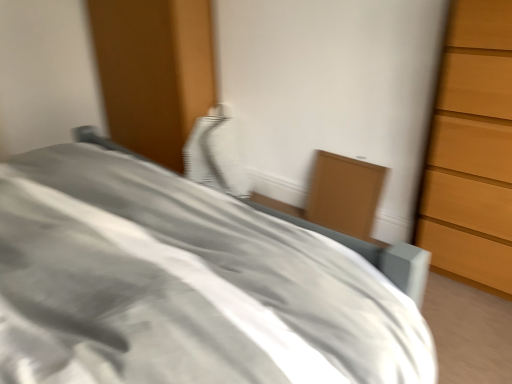
Question: Would you say matte wood cabinet at center-right is part of gray fabric bed at center's contents?

Choices:
 (A) yes
 (B) no

Answer: (B)

Question: Is gray fabric bed at center closer to the viewer compared to matte wood cabinet at center-right?

Choices:
 (A) no
 (B) yes

Answer: (B)

Question: Can you confirm if gray fabric bed at center is thinner than matte wood cabinet at center-right?

Choices:
 (A) yes
 (B) no

Answer: (B)

Question: Is gray fabric bed at center outside matte wood cabinet at center-right?

Choices:
 (A) yes
 (B) no

Answer: (A)

Question: Can you confirm if gray fabric bed at center is wider than matte wood cabinet at center-right?

Choices:
 (A) no
 (B) yes

Answer: (B)

Question: Can you confirm if gray fabric bed at center is bigger than matte wood cabinet at center-right?

Choices:
 (A) no
 (B) yes

Answer: (B)

Question: From the image's perspective, is white textured pillow at center above gray fabric bed at center?

Choices:
 (A) no
 (B) yes

Answer: (B)

Question: Is the position of white textured pillow at center less distant than that of gray fabric bed at center?

Choices:
 (A) no
 (B) yes

Answer: (A)

Question: Can you confirm if white textured pillow at center is smaller than gray fabric bed at center?

Choices:
 (A) yes
 (B) no

Answer: (A)

Question: Is white textured pillow at center positioned far away from gray fabric bed at center?

Choices:
 (A) yes
 (B) no

Answer: (A)

Question: Considering the relative sizes of white textured pillow at center and gray fabric bed at center in the image provided, is white textured pillow at center shorter than gray fabric bed at center?

Choices:
 (A) yes
 (B) no

Answer: (A)

Question: Would you say white textured pillow at center is outside gray fabric bed at center?

Choices:
 (A) no
 (B) yes

Answer: (B)

Question: From a real-world perspective, does matte wood cabinet at center-right stand above white textured pillow at center?

Choices:
 (A) yes
 (B) no

Answer: (B)